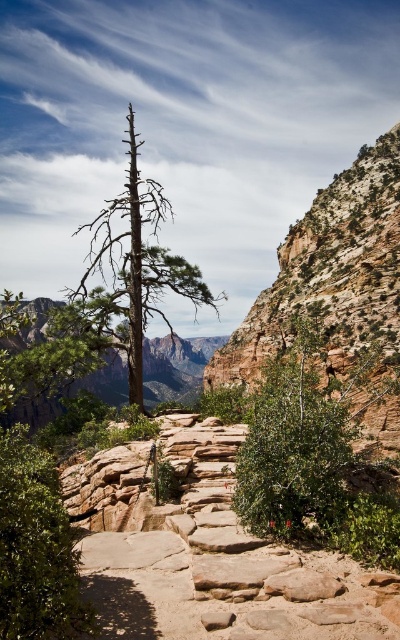
Is green leafy tree at left to the left of brown textured tree at center from the viewer's perspective?

No, green leafy tree at left is not to the left of brown textured tree at center.

Is green leafy tree at left thinner than brown textured tree at center?

Indeed, green leafy tree at left has a lesser width compared to brown textured tree at center.

This screenshot has width=400, height=640. In order to click on green leafy tree at left in this screenshot , I will do `click(36, 547)`.

Describe the element at coordinates (306, 436) in the screenshot. I see `green leafy bush at center` at that location.

Image resolution: width=400 pixels, height=640 pixels. I want to click on green leafy bush at center, so click(x=306, y=436).

Can you confirm if green leafy bush at center is smaller than green leafy tree at left?

Yes.

Who is positioned more to the left, green leafy bush at center or green leafy tree at left?

green leafy tree at left

What do you see at coordinates (306, 436) in the screenshot? This screenshot has height=640, width=400. I see `green leafy bush at center` at bounding box center [306, 436].

Where is `green leafy bush at center`? This screenshot has height=640, width=400. green leafy bush at center is located at coordinates (306, 436).